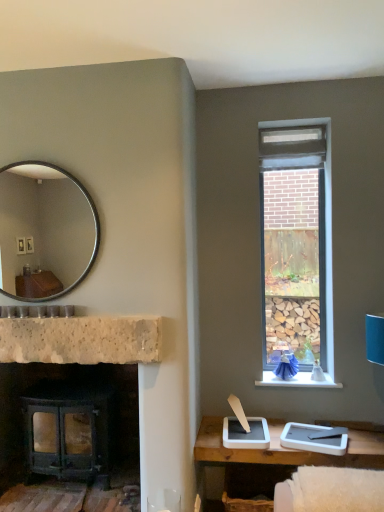
Question: In terms of size, does natural stone fireplace at center appear bigger or smaller than white stone window sill at upper right?

Choices:
 (A) big
 (B) small

Answer: (A)

Question: Looking at their shapes, would you say natural stone fireplace at center is wider or thinner than white stone window sill at upper right?

Choices:
 (A) thin
 (B) wide

Answer: (A)

Question: Which is farther from the matte black wood-burning stove at lower left?

Choices:
 (A) silver metallic mirror at upper left
 (B) natural stone fireplace at center
 (C) white stone window sill at upper right

Answer: (A)

Question: Which object is the farthest from the white stone window sill at upper right?

Choices:
 (A) silver metallic mirror at upper left
 (B) natural stone fireplace at center
 (C) matte black wood-burning stove at lower left

Answer: (A)